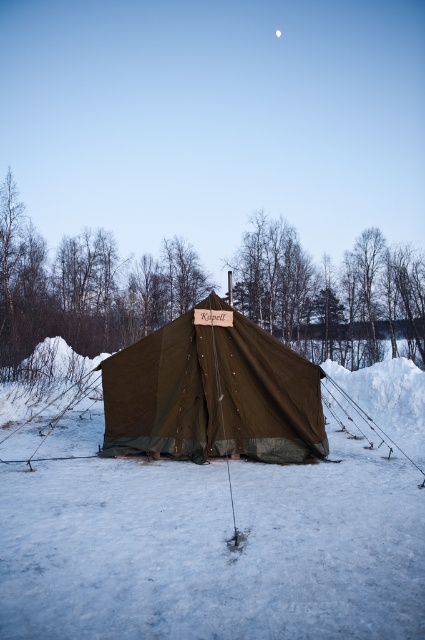
Question: Can you confirm if white fluffy snow at center is smaller than olive green canvas tent at center?

Choices:
 (A) no
 (B) yes

Answer: (A)

Question: Considering the real-world distances, which object is farthest from the white fluffy snow at center?

Choices:
 (A) white matte moon at upper center
 (B) olive green canvas tent at center

Answer: (A)

Question: Which of the following is the farthest from the observer?

Choices:
 (A) white matte moon at upper center
 (B) white fluffy snow at center
 (C) olive green canvas tent at center

Answer: (A)

Question: Can you confirm if white fluffy snow at center is wider than white matte moon at upper center?

Choices:
 (A) yes
 (B) no

Answer: (A)

Question: Which of the following is the farthest from the observer?

Choices:
 (A) (305, 518)
 (B) (257, 369)
 (C) (277, 35)

Answer: (C)

Question: Does white fluffy snow at center appear on the left side of olive green canvas tent at center?

Choices:
 (A) yes
 (B) no

Answer: (B)